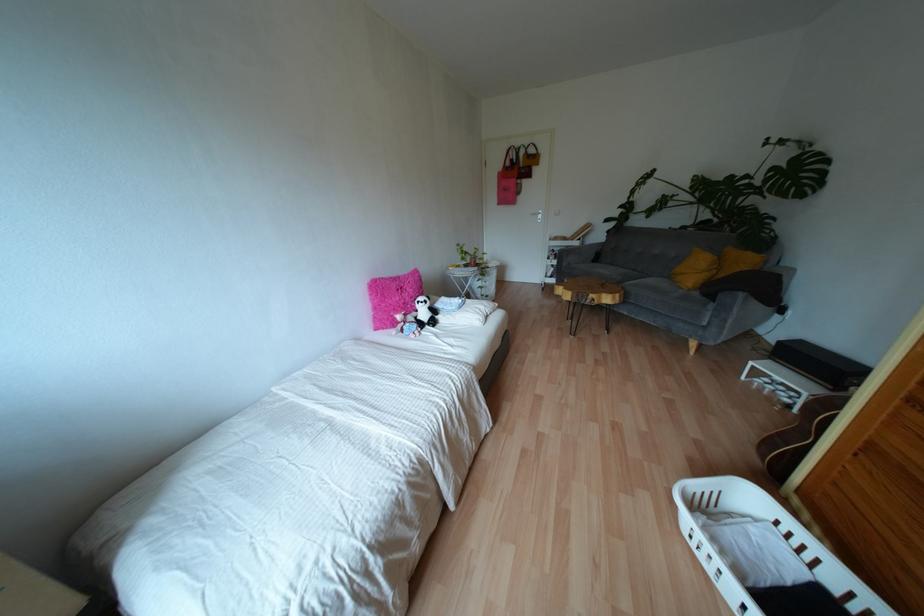
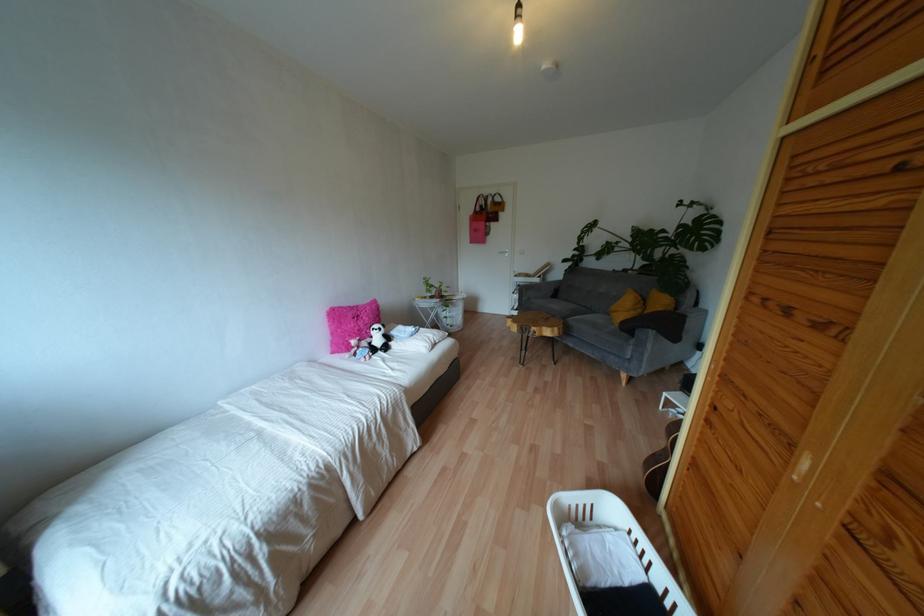
Where in the second image is the point corresponding to (539,216) from the first image?

(505, 254)